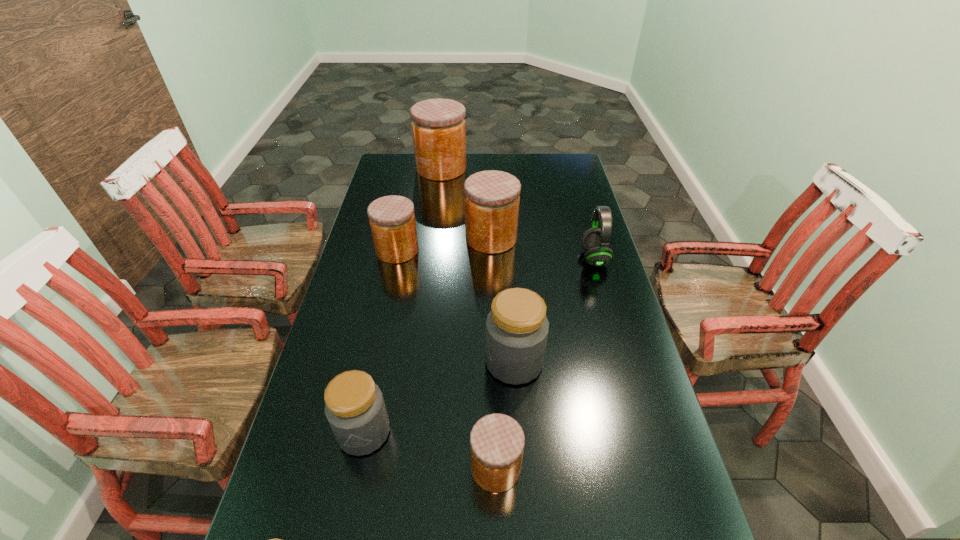
The width and height of the screenshot is (960, 540). Identify the location of the third closest gray jar to the third biggest orange jar. (275, 539).

Identify which gray jar is the third nearest to the second smallest orange jar. Please provide its 2D coordinates. Your answer should be formatted as a tuple, i.e. [(x, y)], where the tuple contains the x and y coordinates of a point satisfying the conditions above.

[(275, 539)]

I want to click on free location that satisfies the following two spatial constraints: 1. on the surface of the fifth farthest object near the warning symbol; 2. on the surface of the second biggest gray jar near the warning symbol, so click(519, 431).